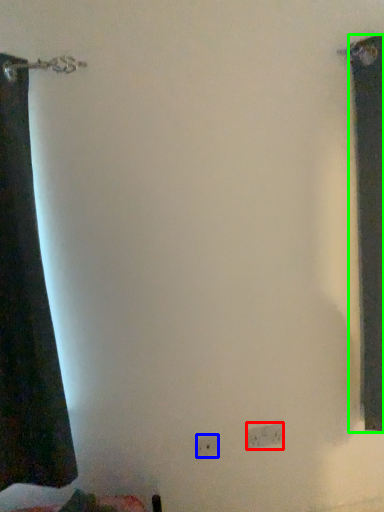
Question: Considering the real-world distances, which object is farthest from electric outlet (highlighted by a red box)? electric outlet (highlighted by a blue box) or curtain (highlighted by a green box)?

Choices:
 (A) electric outlet
 (B) curtain

Answer: (B)